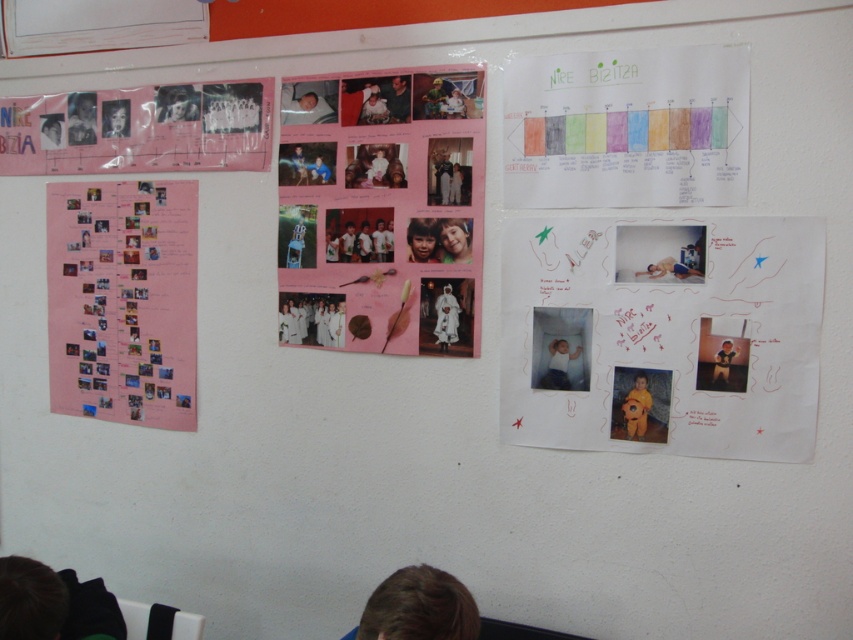
Can you confirm if pink paper poster at left is smaller than matte pink poster at upper left?

Yes, pink paper poster at left is smaller than matte pink poster at upper left.

Does pink paper poster at left appear on the left side of matte pink poster at upper left?

Correct, you'll find pink paper poster at left to the left of matte pink poster at upper left.

Who is more forward, (91, 248) or (73, 172)?

Point (91, 248)

This screenshot has height=640, width=853. Find the location of `pink paper poster at left`. pink paper poster at left is located at coordinates (122, 300).

Is white paper at center bigger than matte pink poster at upper left?

No.

Where is `white paper at center`? The height and width of the screenshot is (640, 853). white paper at center is located at coordinates (663, 336).

At what (x,y) coordinates should I click in order to perform the action: click on white paper at center. Please return your answer as a coordinate pair (x, y). Looking at the image, I should click on (663, 336).

Is white paper at center to the right of pink paper poster at left from the viewer's perspective?

Yes, white paper at center is to the right of pink paper poster at left.

Does white paper at center have a lesser height compared to pink paper poster at left?

Correct, white paper at center is not as tall as pink paper poster at left.

This screenshot has width=853, height=640. In order to click on white paper at center in this screenshot , I will do `click(663, 336)`.